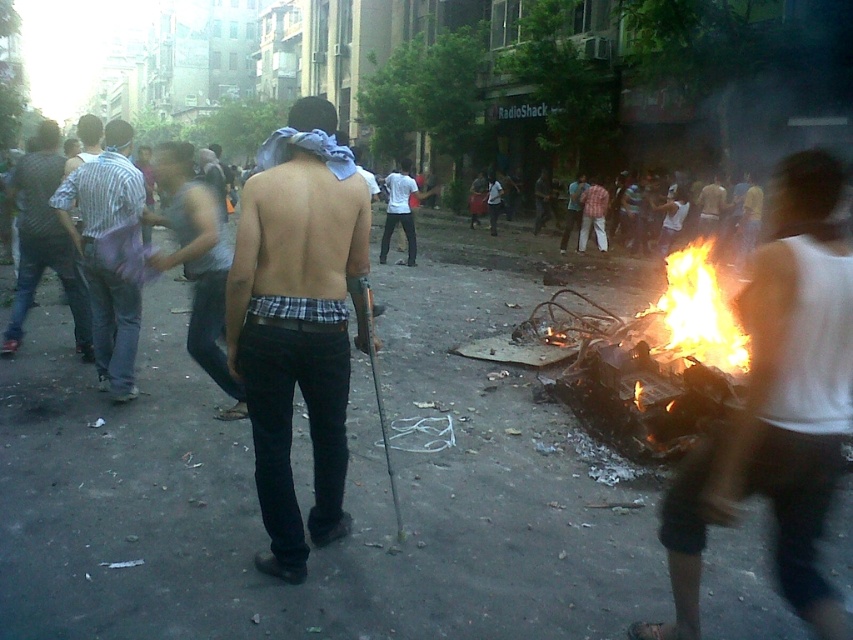
You are a photographer trying to capture a clear shot of both the white cotton tank top at right and the striped shirt at left. Since you can only focus on one subject at a time, which one should you choose to ensure the other remains somewhat in focus?

You should focus on the white cotton tank top at right because it is closer to you than the striped shirt at left. By focusing on the nearer subject, the farther one will still be partially in focus due to the depth of field.

You are a journalist trying to capture the scene. You notice the striped shirt at center and the flaming debris at center. Which object is larger in the image?

The striped shirt at center is smaller than the flaming debris at center, so the flaming debris at center is larger.

You are a delivery drone operator trying to fly a drone through the chaotic urban scene. The drone needs to pass between the white cotton tank top at right and the striped shirt at left. The drone has a wingspan of 1.5 meters. Can the drone safely navigate between them without crashing?

The distance between the white cotton tank top at right and the striped shirt at left is 6.44 meters, which is more than enough space for the drone with a 1.5 meter wingspan to pass safely between them.